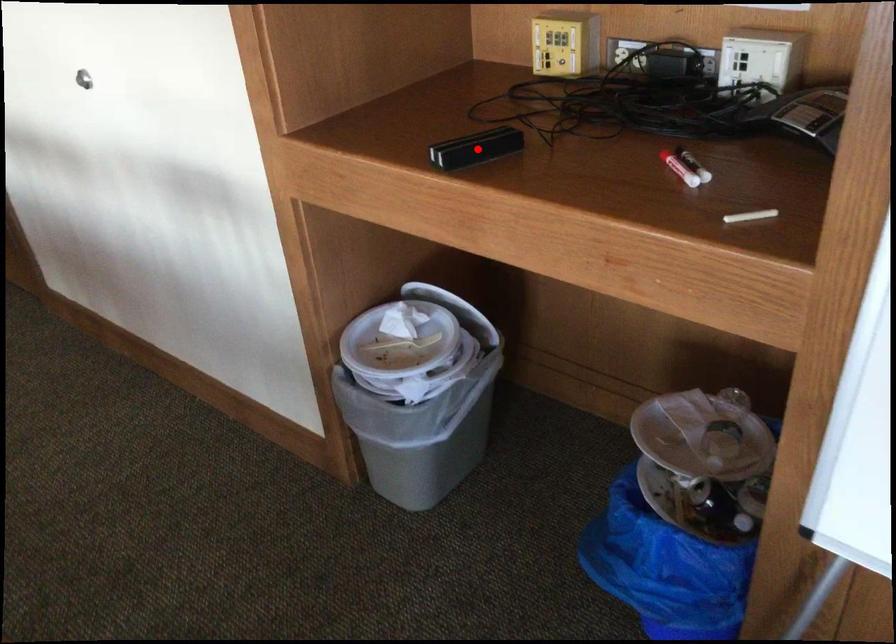
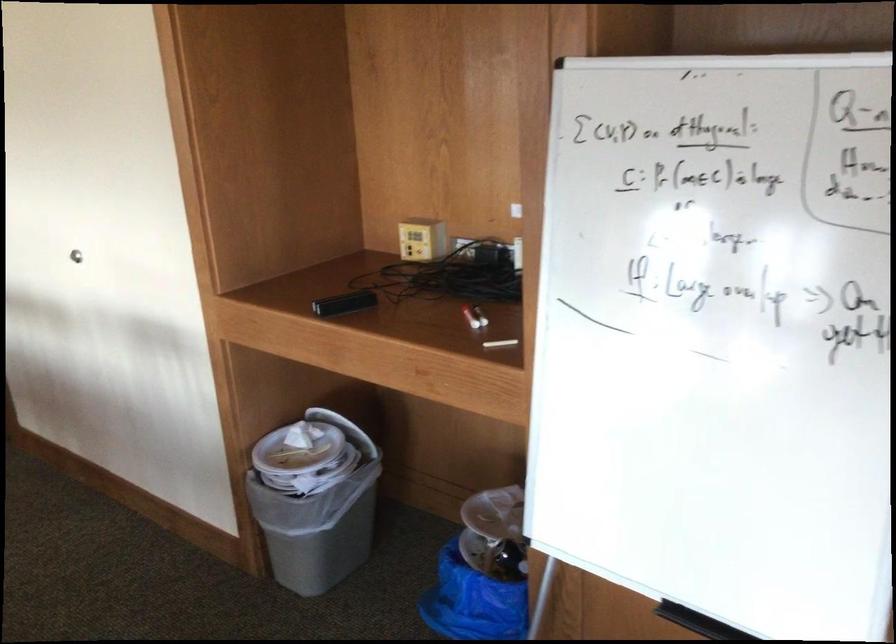
Where in the second image is the point corresponding to the highlighted location from the first image?

(343, 303)